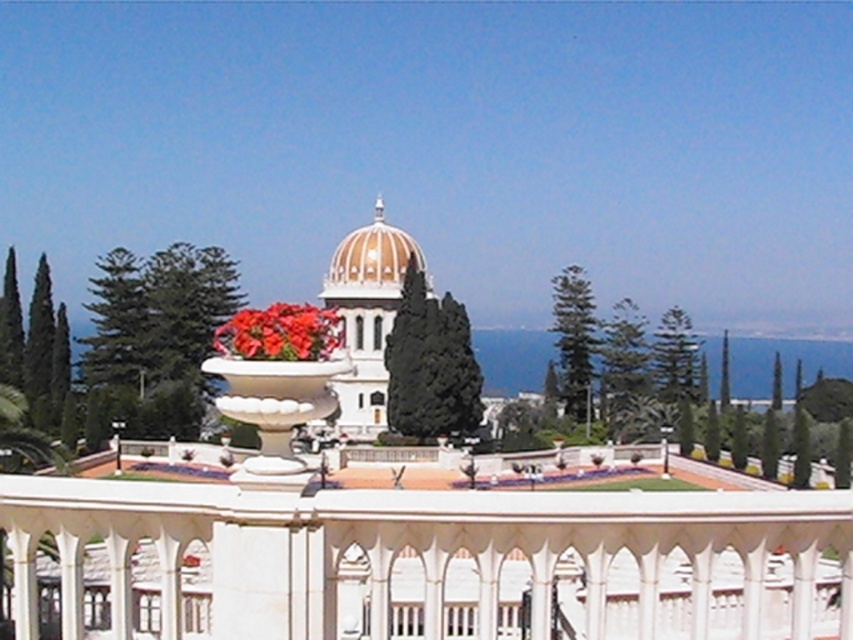
Question: Which point is farther to the camera?

Choices:
 (A) matte orange dome at center
 (B) green glossy cypress tree at upper center
 (C) dark green textured cypress tree at center

Answer: (B)

Question: Does dark green textured cypress tree at center have a greater width compared to glossy ceramic flowers at center?

Choices:
 (A) no
 (B) yes

Answer: (A)

Question: Among these points, which one is farthest from the camera?

Choices:
 (A) (374, 228)
 (B) (264, 458)
 (C) (445, 308)
 (D) (312, 308)

Answer: (A)

Question: Can you confirm if glossy ceramic flowers at center is thinner than green glossy cypress tree at upper center?

Choices:
 (A) yes
 (B) no

Answer: (B)

Question: Is white glossy vase at center above green textured cypress tree at center-right?

Choices:
 (A) no
 (B) yes

Answer: (A)

Question: Which point is farther to the camera?

Choices:
 (A) green textured cypress tree at center-right
 (B) dark green textured cypress tree at center
 (C) matte orange dome at center

Answer: (C)